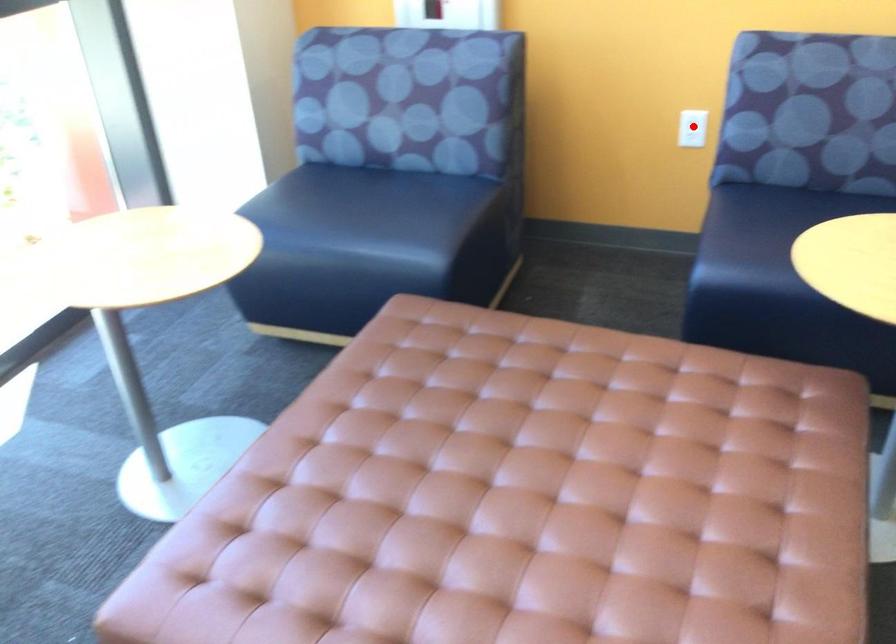
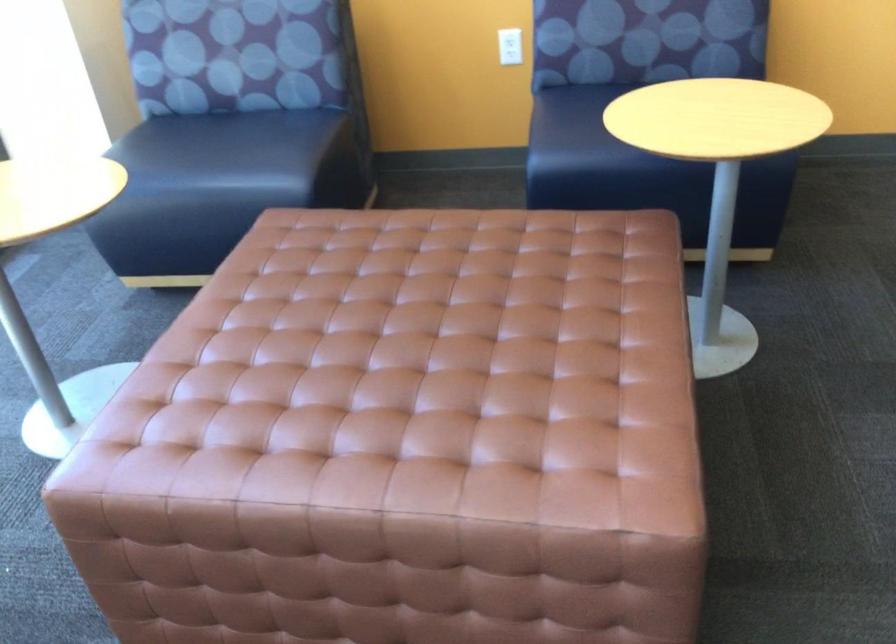
The point at the highlighted location is marked in the first image. Where is the corresponding point in the second image?

(510, 46)